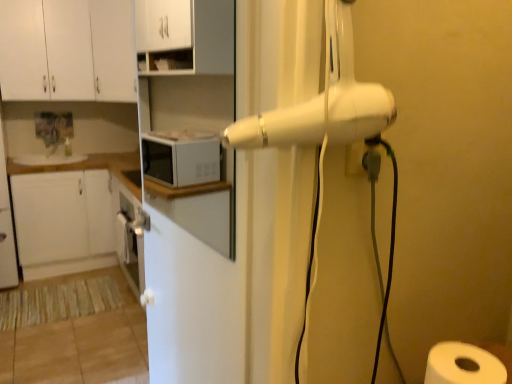
Question: Is the position of white glossy counter top at upper left less distant than that of white matte cabinet at upper center, the second cabinetry positioned from the bottom?

Choices:
 (A) yes
 (B) no

Answer: (B)

Question: Is white glossy counter top at upper left not inside white matte cabinet at upper center, the second cabinetry positioned from the bottom?

Choices:
 (A) yes
 (B) no

Answer: (A)

Question: Can you confirm if white glossy counter top at upper left is positioned to the right of white matte cabinet at upper center, the 3th cabinetry viewed from the top?

Choices:
 (A) no
 (B) yes

Answer: (A)

Question: Does white glossy counter top at upper left have a larger size compared to white matte cabinet at upper center, the second cabinetry positioned from the bottom?

Choices:
 (A) no
 (B) yes

Answer: (A)

Question: Does white glossy counter top at upper left have a lesser height compared to white matte cabinet at upper center, the second cabinetry positioned from the bottom?

Choices:
 (A) no
 (B) yes

Answer: (B)

Question: Considering the relative sizes of white glossy counter top at upper left and white matte cabinet at upper center, the second cabinetry positioned from the bottom, in the image provided, is white glossy counter top at upper left wider than white matte cabinet at upper center, the second cabinetry positioned from the bottom,?

Choices:
 (A) yes
 (B) no

Answer: (A)

Question: Is white paper at lower right completely or partially outside of white glossy screen door at center?

Choices:
 (A) no
 (B) yes

Answer: (B)

Question: Can you confirm if white paper at lower right is smaller than white glossy screen door at center?

Choices:
 (A) yes
 (B) no

Answer: (A)

Question: From the image's perspective, is white paper at lower right under white glossy screen door at center?

Choices:
 (A) yes
 (B) no

Answer: (A)

Question: From a real-world perspective, is white paper at lower right positioned over white glossy screen door at center based on gravity?

Choices:
 (A) no
 (B) yes

Answer: (A)

Question: Could you tell me if white paper at lower right is facing white glossy screen door at center?

Choices:
 (A) yes
 (B) no

Answer: (B)

Question: Can you see white paper at lower right touching white glossy screen door at center?

Choices:
 (A) no
 (B) yes

Answer: (A)

Question: Is white glossy screen door at center aimed at white paper at lower right?

Choices:
 (A) yes
 (B) no

Answer: (B)